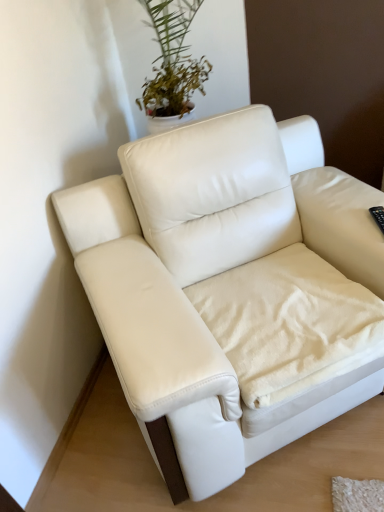
Identify the location of white soft blanket at center. The width and height of the screenshot is (384, 512). (285, 317).

What do you see at coordinates (285, 317) in the screenshot?
I see `white soft blanket at center` at bounding box center [285, 317].

What do you see at coordinates (228, 287) in the screenshot? Image resolution: width=384 pixels, height=512 pixels. I see `white leather couch at center` at bounding box center [228, 287].

The height and width of the screenshot is (512, 384). What are the coordinates of `white leather couch at center` in the screenshot? It's located at (228, 287).

The width and height of the screenshot is (384, 512). In order to click on white soft blanket at center in this screenshot , I will do `click(285, 317)`.

In the image, is white soft blanket at center on the left side or the right side of white leather couch at center?

In the image, white soft blanket at center appears on the right side of white leather couch at center.

Relative to white leather couch at center, is white soft blanket at center in front or behind?

white soft blanket at center is positioned farther from the viewer than white leather couch at center.

Is point (293, 368) positioned after point (241, 237)?

No, (293, 368) is in front of (241, 237).

From the image's perspective, between white soft blanket at center and white leather couch at center, who is located below?

white soft blanket at center appears lower in the image.

From a real-world perspective, does white soft blanket at center sit lower than white leather couch at center?

Correct, in the physical world, white soft blanket at center is lower than white leather couch at center.

Which of these two, white soft blanket at center or white leather couch at center, is wider?

Wider between the two is white leather couch at center.

Is white soft blanket at center taller than white leather couch at center?

Incorrect, the height of white soft blanket at center is not larger of that of white leather couch at center.

Can you confirm if white soft blanket at center is smaller than white leather couch at center?

Correct, white soft blanket at center occupies less space than white leather couch at center.

Is white soft blanket at center spatially inside white leather couch at center, or outside of it?

white soft blanket at center is located inside white leather couch at center.

Is white soft blanket at center far from white leather couch at center?

No, white soft blanket at center is not far away from white leather couch at center.

Based on the photo, is white soft blanket at center facing away from white leather couch at center?

Correct, white soft blanket at center is looking away from white leather couch at center.

How many degrees apart are the facing directions of white soft blanket at center and white leather couch at center?

2.8e-05 degrees.

At what (x,y) coordinates should I click in order to perform the action: click on sheet beneath the white leather couch at center (from a real-world perspective). Please return your answer as a coordinate pair (x, y). The width and height of the screenshot is (384, 512). Looking at the image, I should click on (285, 317).

Based on their positions, is white leather couch at center located to the left or right of white soft blanket at center?

Based on their positions, white leather couch at center is located to the left of white soft blanket at center.

Is white leather couch at center positioned behind white soft blanket at center?

That is False.

Which is farther from the camera, (170, 144) or (275, 370)?

The point (170, 144) is behind.

From the image's perspective, would you say white leather couch at center is shown under white soft blanket at center?

Actually, white leather couch at center appears above white soft blanket at center in the image.

From a real-world perspective, does white leather couch at center stand above white soft blanket at center?

Yes, from a real-world perspective, white leather couch at center is on top of white soft blanket at center.

Between white leather couch at center and white soft blanket at center, which one has smaller width?

Thinner between the two is white soft blanket at center.

Considering the sizes of objects white leather couch at center and white soft blanket at center in the image provided, who is taller, white leather couch at center or white soft blanket at center?

Standing taller between the two is white leather couch at center.

Which of these two, white leather couch at center or white soft blanket at center, is smaller?

With smaller size is white soft blanket at center.

Is white leather couch at center completely or partially outside of white soft blanket at center?

Yes, white leather couch at center is not within white soft blanket at center.

Are white leather couch at center and white soft blanket at center far apart?

No, white leather couch at center is in close proximity to white soft blanket at center.

Is white leather couch at center facing away from white soft blanket at center?

Yes, white leather couch at center is positioned with its back facing white soft blanket at center.

Can you tell me how much white leather couch at center and white soft blanket at center differ in facing direction?

The facing directions of white leather couch at center and white soft blanket at center are 2.8e-05 degrees apart.

Measure the distance between white leather couch at center and white soft blanket at center.

A distance of 14.63 centimeters exists between white leather couch at center and white soft blanket at center.

Find the location of a particular element. The width and height of the screenshot is (384, 512). sheet that is on the right side of white leather couch at center is located at coordinates (285, 317).

Identify the location of studio couch that appears on the left of white soft blanket at center. (228, 287).

Locate an element on the screen. studio couch above the white soft blanket at center (from the image's perspective) is located at coordinates (228, 287).